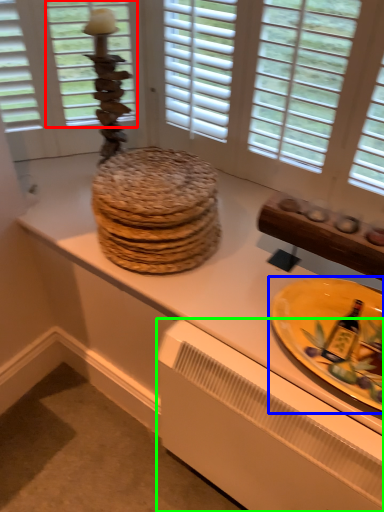
Question: Based on their relative distances, which object is nearer to window screen (highlighted by a red box)? Choose from plate (highlighted by a blue box) and radiator (highlighted by a green box).

Choices:
 (A) plate
 (B) radiator

Answer: (A)